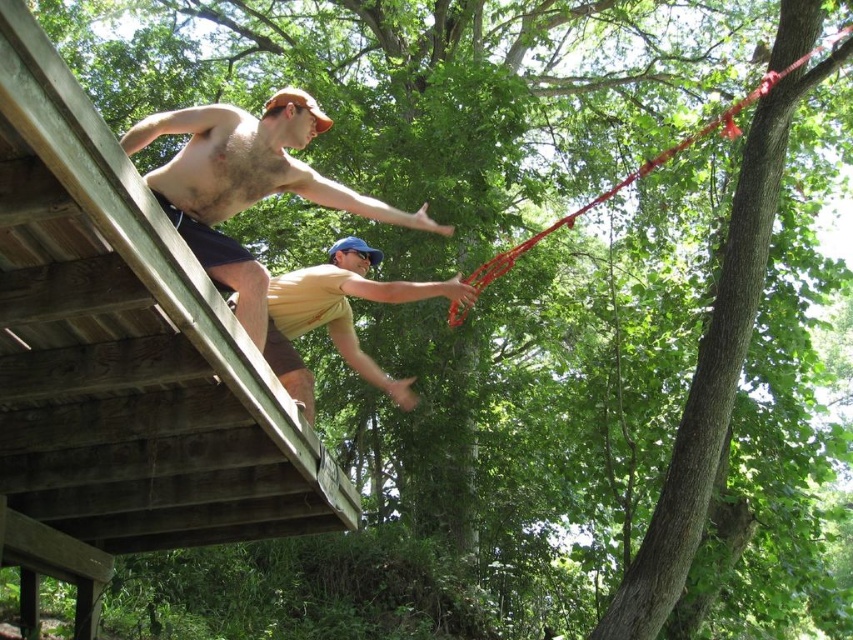
Can you confirm if shiny metallic pole at upper center is positioned to the right of yellow matte shirt at upper center?

No, shiny metallic pole at upper center is not to the right of yellow matte shirt at upper center.

Is shiny metallic pole at upper center shorter than yellow matte shirt at upper center?

No, shiny metallic pole at upper center is not shorter than yellow matte shirt at upper center.

Between point (262, 147) and point (276, 316), which one is positioned behind?

The point (276, 316) is behind.

The width and height of the screenshot is (853, 640). What are the coordinates of `shiny metallic pole at upper center` in the screenshot? It's located at (247, 184).

Which is behind, point (184, 177) or point (682, 145)?

Positioned behind is point (682, 145).

Which is more to the right, shiny metallic pole at upper center or red nylon rope at upper right?

red nylon rope at upper right

Image resolution: width=853 pixels, height=640 pixels. What do you see at coordinates (247, 184) in the screenshot?
I see `shiny metallic pole at upper center` at bounding box center [247, 184].

Locate an element on the screen. The image size is (853, 640). shiny metallic pole at upper center is located at coordinates (247, 184).

Which is below, yellow matte shirt at upper center or red nylon rope at upper right?

Positioned lower is yellow matte shirt at upper center.

Measure the distance between yellow matte shirt at upper center and camera.

yellow matte shirt at upper center and camera are 6.20 meters apart from each other.

Describe the element at coordinates (339, 316) in the screenshot. This screenshot has width=853, height=640. I see `yellow matte shirt at upper center` at that location.

At what (x,y) coordinates should I click in order to perform the action: click on yellow matte shirt at upper center. Please return your answer as a coordinate pair (x, y). This screenshot has height=640, width=853. Looking at the image, I should click on (339, 316).